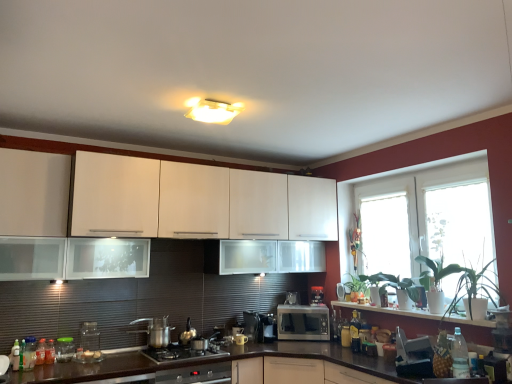
Locate an element on the screen. Image resolution: width=512 pixels, height=384 pixels. blank space to the left of translucent plastic bottle at lower right, marked as the 3th bottle in a front-to-back arrangement is located at coordinates (321, 340).